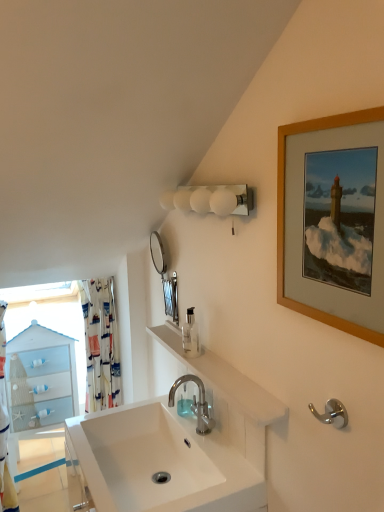
What is the approximate width of white glossy sink at center?

white glossy sink at center is 9.87 centimeters in width.

Measure the distance between wooden picture frame at upper right and camera.

They are 27.79 inches apart.

Where is `printed fabric shower curtain at left, the first shower curtain when ordered from right to left`? This screenshot has height=512, width=384. printed fabric shower curtain at left, the first shower curtain when ordered from right to left is located at coordinates (101, 344).

What do you see at coordinates (190, 335) in the screenshot? I see `clear plastic soap dispenser at center` at bounding box center [190, 335].

This screenshot has height=512, width=384. What are the coordinates of `silver metallic mirror at upper center` in the screenshot? It's located at click(165, 278).

This screenshot has height=512, width=384. I want to click on white glossy sink at center, so click(223, 379).

Which is nearer, (185, 335) or (291, 303)?

Point (185, 335) appears to be farther away from the viewer than point (291, 303).

Find the location of a particular element. The height and width of the screenshot is (512, 384). picture frame above the clear plastic soap dispenser at center (from the image's perspective) is located at coordinates (284, 217).

From the image's perspective, which is below, clear plastic soap dispenser at center or wooden picture frame at upper right?

From the image's view, clear plastic soap dispenser at center is below.

Is clear plastic soap dispenser at center bigger or smaller than wooden picture frame at upper right?

In the image, clear plastic soap dispenser at center appears to be smaller than wooden picture frame at upper right.

Is white fabric shower curtain at left, the 2th shower curtain positioned from the right, at the back of silver metallic mirror at upper center?

No, silver metallic mirror at upper center is not facing away from white fabric shower curtain at left, the 2th shower curtain positioned from the right.

Measure the distance from silver metallic mirror at upper center to white fabric shower curtain at left, the first shower curtain when ordered from left to right.

silver metallic mirror at upper center is 3.89 feet away from white fabric shower curtain at left, the first shower curtain when ordered from left to right.

Which of these two, silver metallic mirror at upper center or white fabric shower curtain at left, the 2th shower curtain positioned from the right, is thinner?

Thinner between the two is silver metallic mirror at upper center.

Which is in front, point (354, 325) or point (5, 302)?

The point (354, 325) is closer.

Which object is positioned more to the left, wooden picture frame at upper right or white fabric shower curtain at left, the 2th shower curtain positioned from the right?

Positioned to the left is white fabric shower curtain at left, the 2th shower curtain positioned from the right.

In terms of size, does wooden picture frame at upper right appear bigger or smaller than white fabric shower curtain at left, the first shower curtain when ordered from left to right?

Clearly, wooden picture frame at upper right is smaller in size than white fabric shower curtain at left, the first shower curtain when ordered from left to right.

Does wooden picture frame at upper right have a greater width compared to white fabric shower curtain at left, the first shower curtain when ordered from left to right?

In fact, wooden picture frame at upper right might be narrower than white fabric shower curtain at left, the first shower curtain when ordered from left to right.

From a real-world perspective, is white fabric shower curtain at left, the 2th shower curtain positioned from the right, physically above polished chrome hook at lower right?

No, from a real-world perspective, white fabric shower curtain at left, the 2th shower curtain positioned from the right, is not over polished chrome hook at lower right

Can we say white fabric shower curtain at left, the 2th shower curtain positioned from the right, lies outside polished chrome hook at lower right?

white fabric shower curtain at left, the 2th shower curtain positioned from the right, is positioned outside polished chrome hook at lower right.

There is a white fabric shower curtain at left, the 2th shower curtain positioned from the right. Identify the location of towel bar above it (from a real-world perspective). (332, 413).

Considering the positions of objects white fabric shower curtain at left, the first shower curtain when ordered from left to right, and polished chrome hook at lower right in the image provided, who is more to the right, white fabric shower curtain at left, the first shower curtain when ordered from left to right, or polished chrome hook at lower right?

Positioned to the right is polished chrome hook at lower right.

Is polished chrome faucet at center aimed at silver metallic mirror at upper center?

No, polished chrome faucet at center is not facing towards silver metallic mirror at upper center.

Is polished chrome faucet at center bigger than silver metallic mirror at upper center?

Correct, polished chrome faucet at center is larger in size than silver metallic mirror at upper center.

Between point (170, 406) and point (176, 296), which one is positioned in front?

Positioned in front is point (170, 406).

Which of these two, polished chrome faucet at center or silver metallic mirror at upper center, is wider?

With larger width is polished chrome faucet at center.

Does point (107, 438) come closer to viewer compared to point (174, 349)?

No, (107, 438) is behind (174, 349).

What are the coordinates of `sink below the white glossy sink at center (from the image's perspective)` in the screenshot? It's located at (169, 459).

Is white ceramic sink at center next to white glossy sink at center and touching it?

No, white ceramic sink at center is not next to white glossy sink at center.

Locate an element on the screen. This screenshot has height=512, width=384. soap dispenser above the white ceramic sink at center (from the image's perspective) is located at coordinates click(x=190, y=335).

From the image's perspective, is white ceramic sink at center above or below clear plastic soap dispenser at center?

Based on their image positions, white ceramic sink at center is located beneath clear plastic soap dispenser at center.

Consider the image. Considering the sizes of white ceramic sink at center and clear plastic soap dispenser at center in the image, is white ceramic sink at center taller or shorter than clear plastic soap dispenser at center?

Considering their sizes, white ceramic sink at center has less height than clear plastic soap dispenser at center.

Where is `picture frame on the right of clear plastic soap dispenser at center`? picture frame on the right of clear plastic soap dispenser at center is located at coordinates (284, 217).

Where is `mirror that is above the white fabric shower curtain at left, the first shower curtain when ordered from left to right (from a real-world perspective)`? This screenshot has height=512, width=384. mirror that is above the white fabric shower curtain at left, the first shower curtain when ordered from left to right (from a real-world perspective) is located at coordinates (165, 278).

Considering their positions, is white frosted glass sconce at upper center positioned closer to silver metallic mirror at upper center than wooden picture frame at upper right?

white frosted glass sconce at upper center lies closer to silver metallic mirror at upper center than the other object.

Estimate the real-world distances between objects in this image. Which object is further from printed fabric shower curtain at left, the first shower curtain when ordered from right to left, polished chrome faucet at center or white fabric shower curtain at left, the 2th shower curtain positioned from the right?

polished chrome faucet at center is positioned further to the anchor printed fabric shower curtain at left, the first shower curtain when ordered from right to left.

From the image, which object appears to be farther from white ceramic sink at center, silver metallic mirror at upper center or clear plastic soap dispenser at center?

Among the two, silver metallic mirror at upper center is located further to white ceramic sink at center.

Considering their positions, is polished chrome hook at lower right positioned closer to white fabric shower curtain at left, the first shower curtain when ordered from left to right, than white ceramic sink at center?

white ceramic sink at center lies closer to white fabric shower curtain at left, the first shower curtain when ordered from left to right, than the other object.

When comparing their distances from silver metallic mirror at upper center, does white fabric shower curtain at left, the first shower curtain when ordered from left to right, or polished chrome hook at lower right seem closer?

polished chrome hook at lower right is closer to silver metallic mirror at upper center.

Which object lies further to the anchor point white fabric shower curtain at left, the first shower curtain when ordered from left to right, clear plastic soap dispenser at center or silver metallic mirror at upper center?

clear plastic soap dispenser at center lies further to white fabric shower curtain at left, the first shower curtain when ordered from left to right, than the other object.

Estimate the real-world distances between objects in this image. Which object is further from polished chrome faucet at center, polished chrome hook at lower right or white glossy sink at center?

Based on the image, polished chrome hook at lower right appears to be further to polished chrome faucet at center.

Based on their spatial positions, is polished chrome hook at lower right or wooden picture frame at upper right closer to white ceramic sink at center?

Among the two, polished chrome hook at lower right is located nearer to white ceramic sink at center.

You are a GUI agent. You are given a task and a screenshot of the screen. Output one action in this format:
    pyautogui.click(x=<x>, y=<y>)
    Task: Click on the towel bar between wooden picture frame at upper right and polished chrome faucet at center from front to back
    
    Given the screenshot: What is the action you would take?
    pyautogui.click(x=332, y=413)

This screenshot has height=512, width=384. I want to click on sink between white frosted glass sconce at upper center and white fabric shower curtain at left, the first shower curtain when ordered from left to right, in the up-down direction, so tap(169, 459).

Locate an element on the screen. The height and width of the screenshot is (512, 384). towel bar between wooden picture frame at upper right and printed fabric shower curtain at left, the 2th shower curtain from the left, along the z-axis is located at coordinates (332, 413).

Image resolution: width=384 pixels, height=512 pixels. I want to click on counter top between polished chrome hook at lower right and silver metallic mirror at upper center in the front-back direction, so click(x=223, y=379).